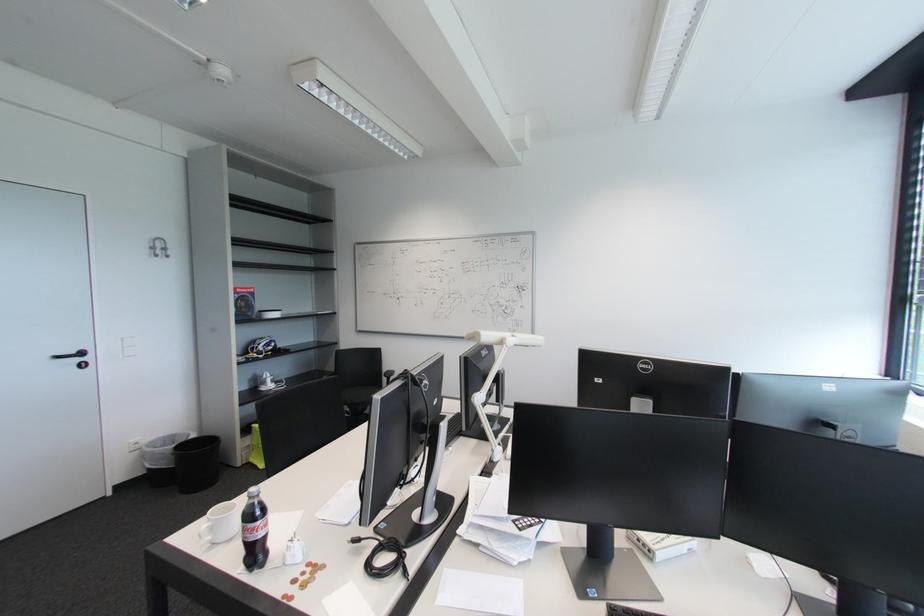
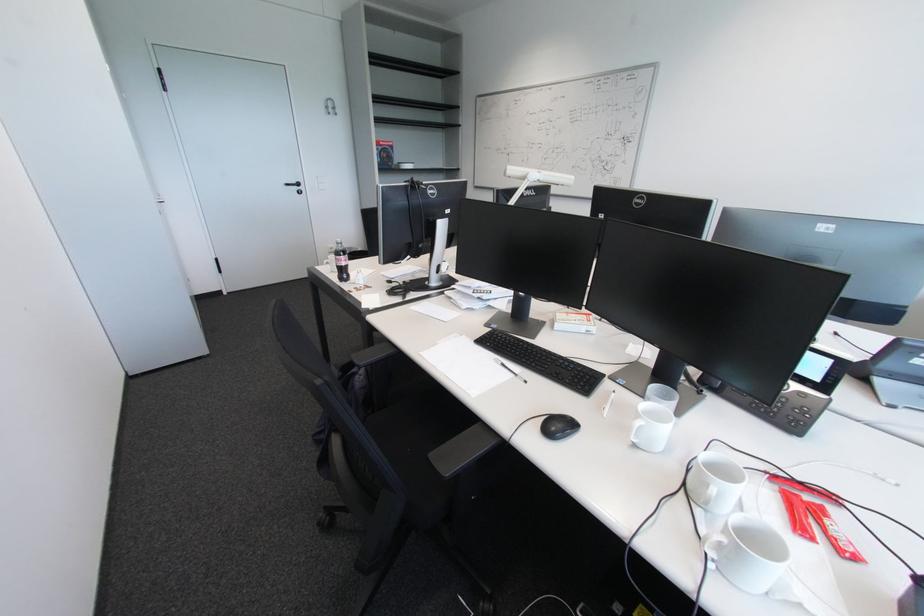
Consider the image. First-person continuous shooting, in which direction is the camera rotating?

The camera rotated toward left-down.